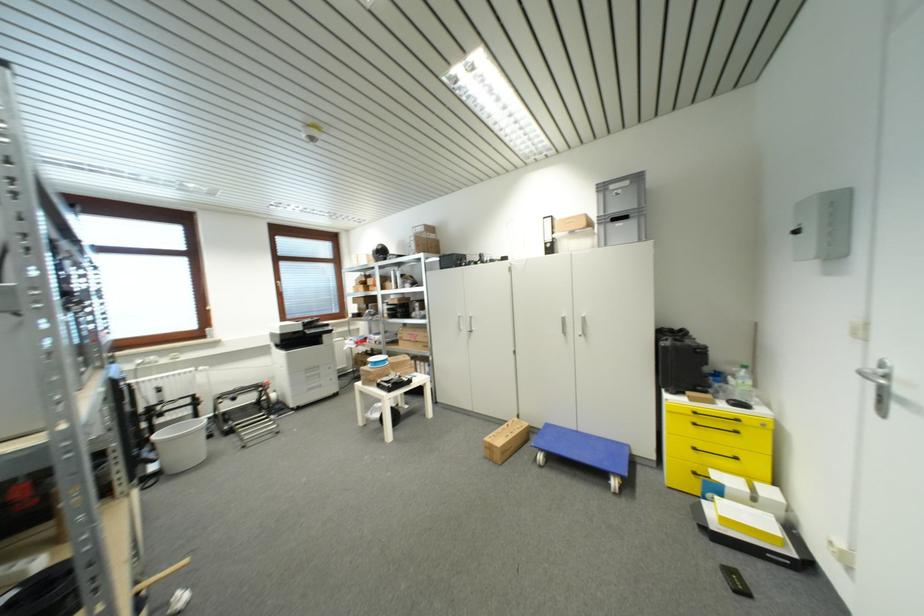
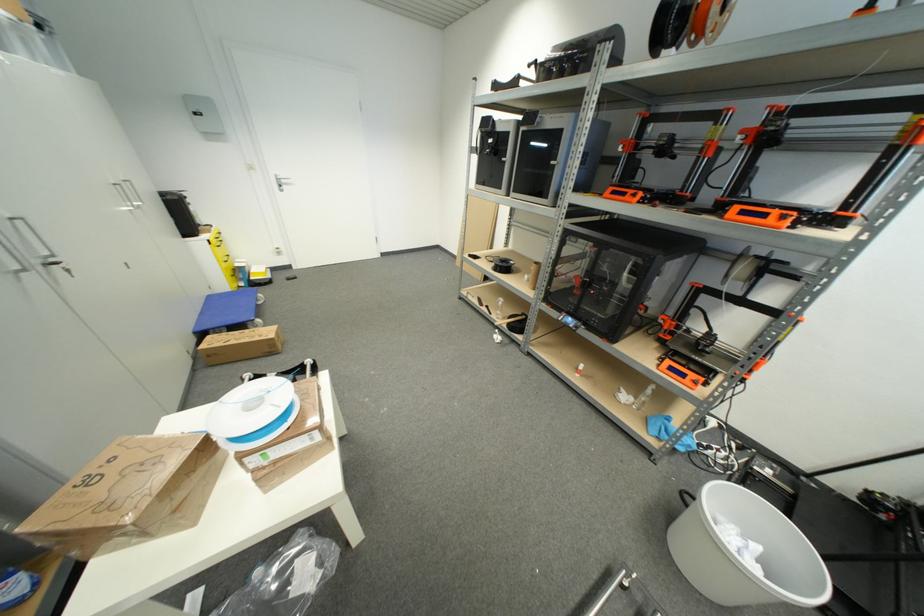
Find the pixel in the second image that matches point 633,448 in the first image.

(213, 299)